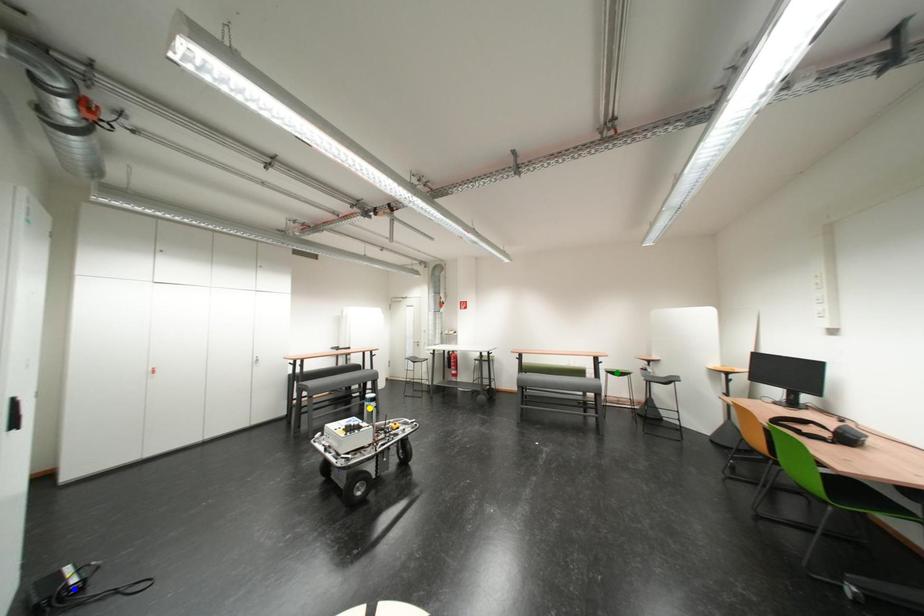
Looking at this image, order these from nearest to farthest:
green point, blue point, yellow point

yellow point → green point → blue point